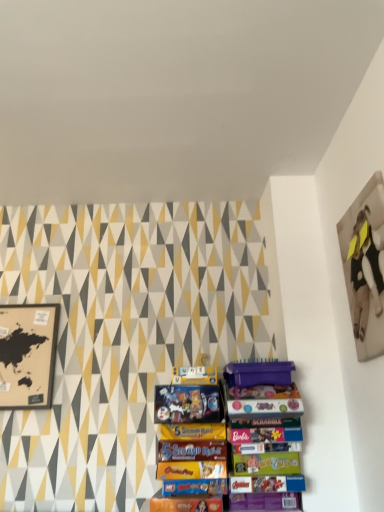
Image resolution: width=384 pixels, height=512 pixels. Describe the element at coordinates (365, 266) in the screenshot. I see `matte black picture frame at upper right, placed as the second picture frame when sorted from left to right` at that location.

Measure the distance between point (383,298) and camera.

Point (383,298) and camera are 1.45 meters apart.

In order to face matte black picture frame at upper right, marked as the 2th picture frame in a back-to-front arrangement, should I rotate leftwards or rightwards?

To align with it, rotate right about 21.737°.

Locate an element on the screen. The height and width of the screenshot is (512, 384). matte black picture frame at upper right, which is the first picture frame in front-to-back order is located at coordinates (365, 266).

What is the approximate width of matte black picture frame at upper right, acting as the 1th picture frame starting from the top?

matte black picture frame at upper right, acting as the 1th picture frame starting from the top, is 3.41 centimeters wide.

What do you see at coordinates (27, 355) in the screenshot? I see `matte black map at left, positioned as the first picture frame in back-to-front order` at bounding box center [27, 355].

I want to click on matte black map at left, which is the 1th picture frame in left-to-right order, so coord(27,355).

Where is `matte black picture frame at upper right, which is the first picture frame in front-to-back order`? matte black picture frame at upper right, which is the first picture frame in front-to-back order is located at coordinates (365, 266).

Visually, is matte black map at left, which is the 1th picture frame in left-to-right order, positioned to the left or to the right of matte black picture frame at upper right, the 1th picture frame from the right?

In the image, matte black map at left, which is the 1th picture frame in left-to-right order, appears on the left side of matte black picture frame at upper right, the 1th picture frame from the right.

Considering the relative positions of matte black map at left, acting as the second picture frame starting from the top, and matte black picture frame at upper right, marked as the 2th picture frame in a back-to-front arrangement, in the image provided, is matte black map at left, acting as the second picture frame starting from the top, in front of matte black picture frame at upper right, marked as the 2th picture frame in a back-to-front arrangement,?

No, it is behind matte black picture frame at upper right, marked as the 2th picture frame in a back-to-front arrangement.

Which is closer to the camera, (35, 405) or (378, 249)?

Point (378, 249)

From the image's perspective, would you say matte black map at left, which is the 1th picture frame in left-to-right order, is shown under matte black picture frame at upper right, placed as the second picture frame when sorted from left to right?

Yes, from the image's perspective, matte black map at left, which is the 1th picture frame in left-to-right order, is below matte black picture frame at upper right, placed as the second picture frame when sorted from left to right.

From a real-world perspective, is matte black map at left, positioned as the first picture frame in back-to-front order, on top of matte black picture frame at upper right, acting as the 1th picture frame starting from the top?

Incorrect, from a real-world perspective, matte black map at left, positioned as the first picture frame in back-to-front order, is lower than matte black picture frame at upper right, acting as the 1th picture frame starting from the top.

Does matte black map at left, the first picture frame in the bottom-to-top sequence, have a lesser width compared to matte black picture frame at upper right, marked as the 2th picture frame in a bottom-to-top arrangement?

Incorrect, the width of matte black map at left, the first picture frame in the bottom-to-top sequence, is not less than that of matte black picture frame at upper right, marked as the 2th picture frame in a bottom-to-top arrangement.

Between matte black map at left, the 2th picture frame in the front-to-back sequence, and matte black picture frame at upper right, the 1th picture frame from the right, which one has less height?

matte black map at left, the 2th picture frame in the front-to-back sequence, is shorter.

Is matte black map at left, the first picture frame in the bottom-to-top sequence, bigger or smaller than matte black picture frame at upper right, marked as the 2th picture frame in a back-to-front arrangement?

Considering their sizes, matte black map at left, the first picture frame in the bottom-to-top sequence, takes up less space than matte black picture frame at upper right, marked as the 2th picture frame in a back-to-front arrangement.

Does matte black map at left, acting as the second picture frame starting from the top, contain matte black picture frame at upper right, the 1th picture frame from the right?

Definitely not — matte black picture frame at upper right, the 1th picture frame from the right, is not inside matte black map at left, acting as the second picture frame starting from the top.

Is matte black map at left, which is the 1th picture frame in left-to-right order, directly adjacent to matte black picture frame at upper right, the 1th picture frame from the right?

matte black map at left, which is the 1th picture frame in left-to-right order, is not next to matte black picture frame at upper right, the 1th picture frame from the right, and they're not touching.

Could you tell me if matte black map at left, the 2th picture frame in the front-to-back sequence, is turned towards matte black picture frame at upper right, acting as the 1th picture frame starting from the top?

No, matte black map at left, the 2th picture frame in the front-to-back sequence, is not facing towards matte black picture frame at upper right, acting as the 1th picture frame starting from the top.

Can you tell me how much matte black map at left, positioned as the second picture frame in right-to-left order, and matte black picture frame at upper right, which is the first picture frame in front-to-back order, differ in facing direction?

The angular difference between matte black map at left, positioned as the second picture frame in right-to-left order, and matte black picture frame at upper right, which is the first picture frame in front-to-back order, is 89.1 degrees.

What are the coordinates of `picture frame on the left side of matte black picture frame at upper right, marked as the 2th picture frame in a back-to-front arrangement` in the screenshot? It's located at (27, 355).

From the picture: Which is more to the left, matte black picture frame at upper right, the 1th picture frame from the right, or matte black map at left, which is the 1th picture frame in left-to-right order?

From the viewer's perspective, matte black map at left, which is the 1th picture frame in left-to-right order, appears more on the left side.

Which object is further away from the camera, matte black picture frame at upper right, marked as the 2th picture frame in a back-to-front arrangement, or matte black map at left, acting as the second picture frame starting from the top?

matte black map at left, acting as the second picture frame starting from the top, is further away from the camera.

Which is farther, (365,241) or (36,305)?

The point (36,305) is farther.

From the image's perspective, which is above, matte black picture frame at upper right, which is the first picture frame in front-to-back order, or matte black map at left, the first picture frame in the bottom-to-top sequence?

matte black picture frame at upper right, which is the first picture frame in front-to-back order, from the image's perspective.

From a real-world perspective, who is located higher, matte black picture frame at upper right, placed as the second picture frame when sorted from left to right, or matte black map at left, the 2th picture frame in the front-to-back sequence?

matte black picture frame at upper right, placed as the second picture frame when sorted from left to right.

Does matte black picture frame at upper right, placed as the second picture frame when sorted from left to right, have a lesser width compared to matte black map at left, which is the 1th picture frame in left-to-right order?

Correct, the width of matte black picture frame at upper right, placed as the second picture frame when sorted from left to right, is less than that of matte black map at left, which is the 1th picture frame in left-to-right order.

Between matte black picture frame at upper right, marked as the 2th picture frame in a bottom-to-top arrangement, and matte black map at left, positioned as the second picture frame in right-to-left order, which one has more height?

With more height is matte black picture frame at upper right, marked as the 2th picture frame in a bottom-to-top arrangement.

Is matte black picture frame at upper right, acting as the 1th picture frame starting from the top, bigger or smaller than matte black map at left, positioned as the first picture frame in back-to-front order?

Considering their sizes, matte black picture frame at upper right, acting as the 1th picture frame starting from the top, takes up more space than matte black map at left, positioned as the first picture frame in back-to-front order.

Does matte black picture frame at upper right, which is the first picture frame in front-to-back order, contain matte black map at left, positioned as the first picture frame in back-to-front order?

No, matte black map at left, positioned as the first picture frame in back-to-front order, is located outside of matte black picture frame at upper right, which is the first picture frame in front-to-back order.

Are matte black picture frame at upper right, marked as the 2th picture frame in a bottom-to-top arrangement, and matte black map at left, positioned as the first picture frame in back-to-front order, located far from each other?

Yes.

Is matte black picture frame at upper right, which is the first picture frame in front-to-back order, aimed at matte black map at left, positioned as the first picture frame in back-to-front order?

No, matte black picture frame at upper right, which is the first picture frame in front-to-back order, does not turn towards matte black map at left, positioned as the first picture frame in back-to-front order.

Can you tell me how much matte black picture frame at upper right, marked as the 2th picture frame in a bottom-to-top arrangement, and matte black map at left, the first picture frame in the bottom-to-top sequence, differ in facing direction?

The angular difference between matte black picture frame at upper right, marked as the 2th picture frame in a bottom-to-top arrangement, and matte black map at left, the first picture frame in the bottom-to-top sequence, is 89.1 degrees.

This screenshot has width=384, height=512. Identify the location of picture frame below the matte black picture frame at upper right, the 1th picture frame from the right (from a real-world perspective). (27, 355).

Locate an element on the screen. Image resolution: width=384 pixels, height=512 pixels. picture frame behind the matte black picture frame at upper right, the 1th picture frame from the right is located at coordinates (27, 355).

I want to click on picture frame that is on the right side of matte black map at left, positioned as the first picture frame in back-to-front order, so click(x=365, y=266).